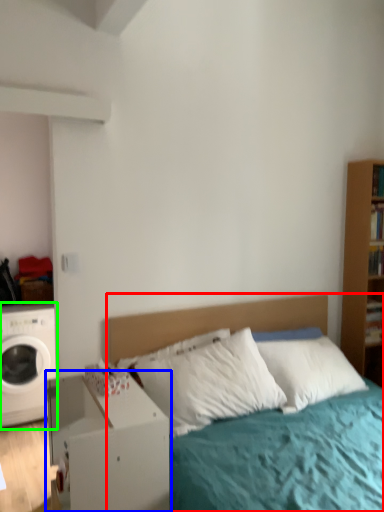
Question: Estimate the real-world distances between objects in this image. Which object is farther from bed (highlighted by a red box), nightstand (highlighted by a blue box) or washing machine (highlighted by a green box)?

Choices:
 (A) nightstand
 (B) washing machine

Answer: (B)